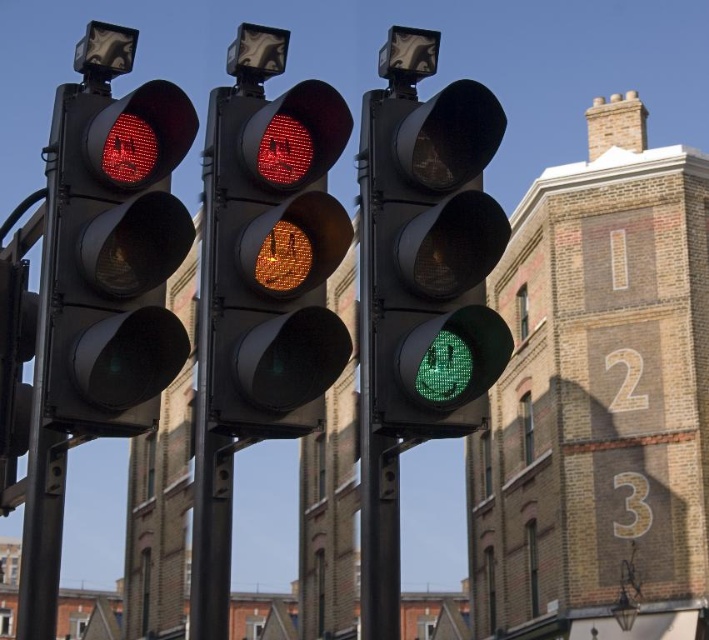
You are a delivery driver approaching the traffic lights. You need to determine which traffic light is closer to you. The options are the matte glass traffic light at center and the green matte traffic light at center. Which one is closer?

The matte glass traffic light at center is closer because it is in front of the green matte traffic light at center.